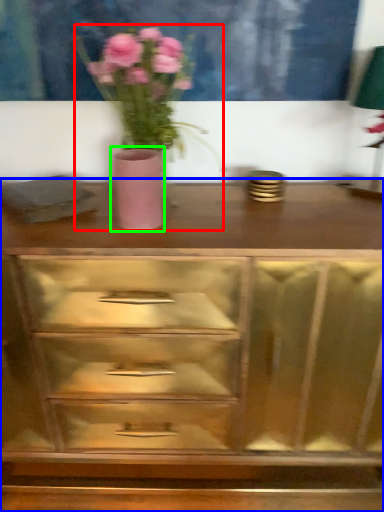
Question: Considering the real-world distances, which object is closest to floral arrangement (highlighted by a red box)? chest of drawers (highlighted by a blue box) or vase (highlighted by a green box).

Choices:
 (A) chest of drawers
 (B) vase

Answer: (B)